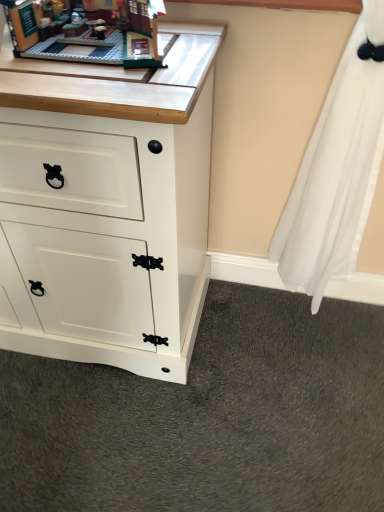
The image size is (384, 512). Identify the location of free location in front of brick-like lego set at upper left. (92, 81).